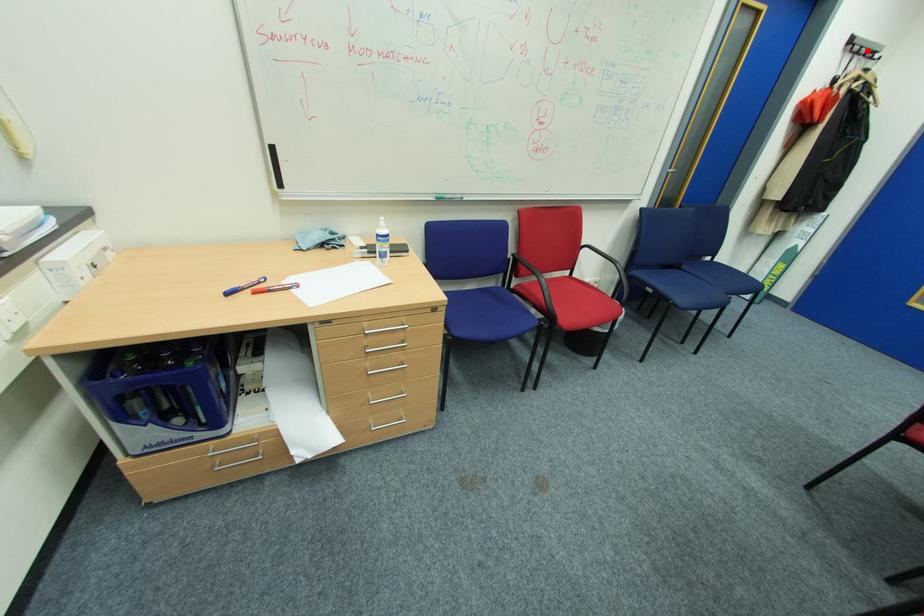
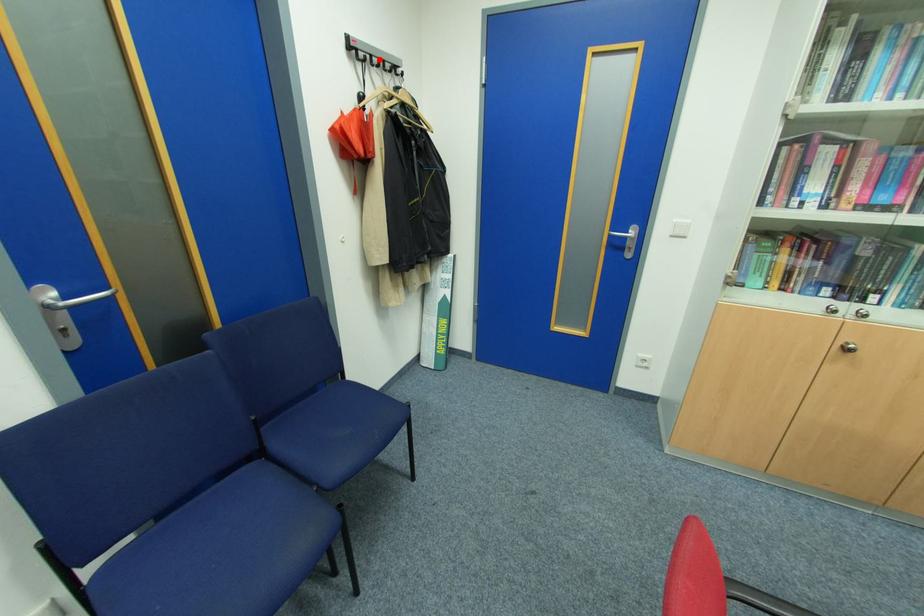
I am providing you with two images of the same scene from different viewpoints. A red point is marked on the first image and another point is marked on the second image. Does the point marked in image1 correspond to the same location as the one in image2?

Yes